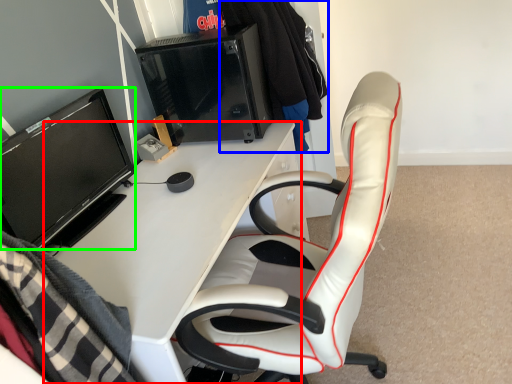
Question: Which object is the closest to the desk (highlighted by a red box)? Choose among these: clothing (highlighted by a blue box) or television (highlighted by a green box).

Choices:
 (A) clothing
 (B) television

Answer: (B)